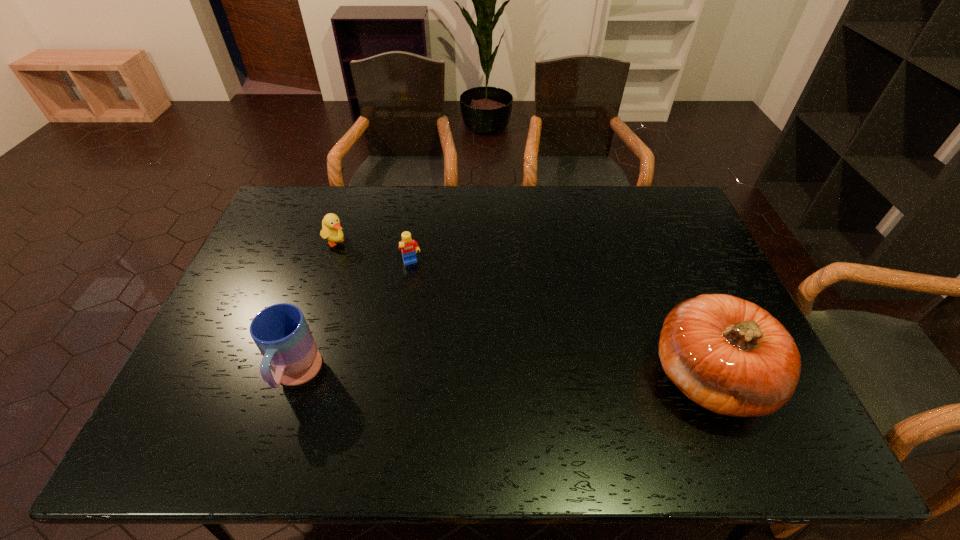
Locate an element on the screen. This screenshot has height=540, width=960. free space at the right edge of the desktop is located at coordinates (679, 247).

Locate an element on the screen. The width and height of the screenshot is (960, 540). blank space at the near left corner is located at coordinates (219, 386).

You are a GUI agent. You are given a task and a screenshot of the screen. Output one action in this format:
    pyautogui.click(x=<x>, y=<y>)
    Task: Click on the free space at the far right corner
    This screenshot has width=960, height=540.
    Given the screenshot: What is the action you would take?
    pyautogui.click(x=636, y=204)

Image resolution: width=960 pixels, height=540 pixels. Find the location of `free spot between the farthest object and the second farthest object`. free spot between the farthest object and the second farthest object is located at coordinates (374, 253).

You are a GUI agent. You are given a task and a screenshot of the screen. Output one action in this format:
    pyautogui.click(x=<x>, y=<y>)
    Task: Click on the blank region between the rightmost object and the Lego
    The image size is (960, 540).
    Given the screenshot: What is the action you would take?
    pyautogui.click(x=560, y=320)

The image size is (960, 540). I want to click on blank region between the mug and the duckling, so click(316, 309).

The height and width of the screenshot is (540, 960). Find the location of `vacant area that lies between the mug and the duckling`. vacant area that lies between the mug and the duckling is located at coordinates (316, 309).

At what (x,y) coordinates should I click in order to perform the action: click on empty space that is in between the mug and the duckling. Please return your answer as a coordinate pair (x, y). The height and width of the screenshot is (540, 960). Looking at the image, I should click on (316, 309).

The height and width of the screenshot is (540, 960). I want to click on empty space that is in between the Lego and the tallest object, so click(560, 320).

What are the coordinates of `free space between the second tallest object and the pumpkin` in the screenshot? It's located at (502, 376).